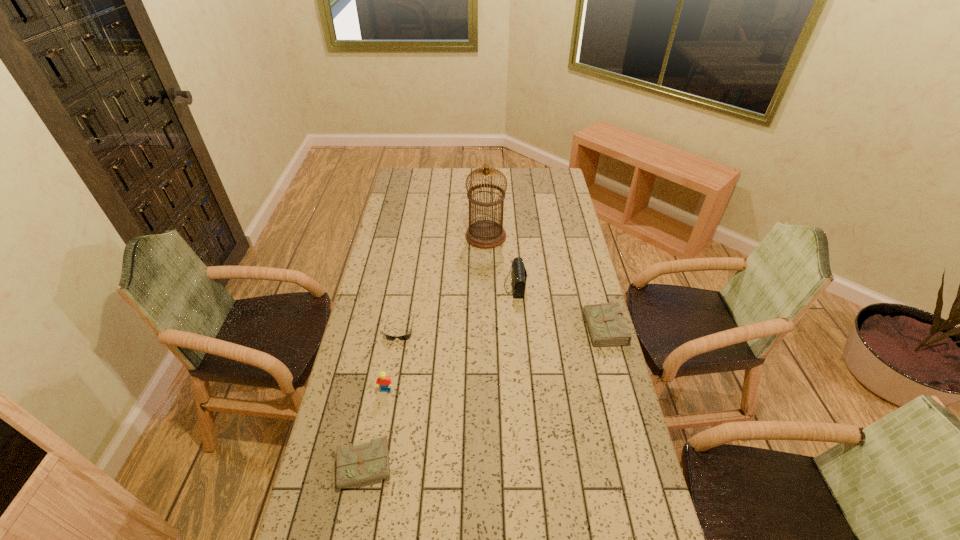
Locate which object is the third closest to the shortest object. Please provide its 2D coordinates. Your answer should be formatted as a tuple, i.e. [(x, y)], where the tuple contains the x and y coordinates of a point satisfying the conditions above.

[(359, 464)]

The width and height of the screenshot is (960, 540). Find the location of `the third closest object relative to the shortest object`. the third closest object relative to the shortest object is located at coordinates (359, 464).

Identify the location of vacant space that satisfies the following two spatial constraints: 1. on the front flap of the rightmost object; 2. on the right side of the clutch bag. (519, 334).

Find the location of `free space that satisfies the following two spatial constraints: 1. on the front-facing side of the farthest object; 2. on the front side of the second shortest object`. free space that satisfies the following two spatial constraints: 1. on the front-facing side of the farthest object; 2. on the front side of the second shortest object is located at coordinates (490, 466).

You are a GUI agent. You are given a task and a screenshot of the screen. Output one action in this format:
    pyautogui.click(x=<x>, y=<y>)
    Task: Click on the vacant point that satisfies the following two spatial constraints: 1. on the front-facing side of the taller diary; 2. on the right side of the shortest object
    The height and width of the screenshot is (540, 960).
    Given the screenshot: What is the action you would take?
    pyautogui.click(x=398, y=334)

Locate an element on the screen. This screenshot has height=540, width=960. vacant region that satisfies the following two spatial constraints: 1. on the front flap of the clutch bag; 2. on the face of the fifth farthest object is located at coordinates (524, 390).